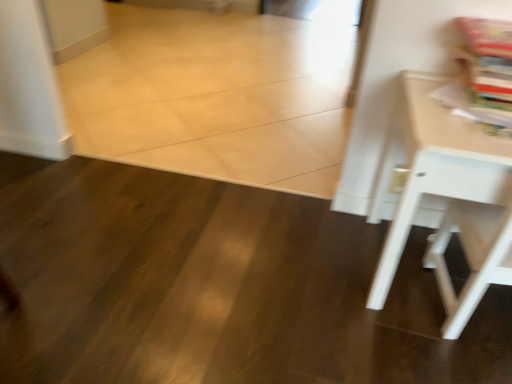
In order to face matte paper magazine at upper right, should I rotate leftwards or rightwards?

A 30.938 degree turn to the right will do.

The image size is (512, 384). Identify the location of matte paper magazine at upper right. (488, 70).

The image size is (512, 384). What do you see at coordinates (488, 70) in the screenshot?
I see `matte paper magazine at upper right` at bounding box center [488, 70].

Image resolution: width=512 pixels, height=384 pixels. What do you see at coordinates (448, 197) in the screenshot?
I see `white matte table at right` at bounding box center [448, 197].

Locate an element on the screen. The width and height of the screenshot is (512, 384). white matte table at right is located at coordinates (448, 197).

I want to click on matte paper magazine at upper right, so click(x=488, y=70).

Is matte paper magazine at upper right to the right of white matte table at right from the viewer's perspective?

Yes, matte paper magazine at upper right is to the right of white matte table at right.

Is matte paper magazine at upper right closer to camera compared to white matte table at right?

No, matte paper magazine at upper right is further to the viewer.

Is point (471, 63) positioned in front of point (464, 206)?

That is True.

From the image's perspective, who appears lower, matte paper magazine at upper right or white matte table at right?

white matte table at right.

From a real-world perspective, is matte paper magazine at upper right positioned over white matte table at right based on gravity?

Yes, from a real-world perspective, matte paper magazine at upper right is on top of white matte table at right.

Looking at this image, between matte paper magazine at upper right and white matte table at right, which one has larger width?

Wider between the two is white matte table at right.

Can you confirm if matte paper magazine at upper right is taller than white matte table at right?

In fact, matte paper magazine at upper right may be shorter than white matte table at right.

Which of these two, matte paper magazine at upper right or white matte table at right, is bigger?

white matte table at right is bigger.

Is matte paper magazine at upper right situated inside white matte table at right or outside?

matte paper magazine at upper right is inside white matte table at right.

Is matte paper magazine at upper right positioned far away from white matte table at right?

Actually, matte paper magazine at upper right and white matte table at right are a little close together.

Is matte paper magazine at upper right turned away from white matte table at right?

Yes, matte paper magazine at upper right is positioned with its back facing white matte table at right.

Find the location of a particular element. Image resolution: width=512 pixels, height=384 pixels. table below the matte paper magazine at upper right (from the image's perspective) is located at coordinates [448, 197].

Is white matte table at right to the left of matte paper magazine at upper right from the viewer's perspective?

Indeed, white matte table at right is positioned on the left side of matte paper magazine at upper right.

Considering the positions of objects white matte table at right and matte paper magazine at upper right in the image provided, who is in front, white matte table at right or matte paper magazine at upper right?

white matte table at right is more forward.

Is point (401, 208) closer to viewer compared to point (471, 113)?

Yes.

From the image's perspective, which one is positioned higher, white matte table at right or matte paper magazine at upper right?

matte paper magazine at upper right is shown above in the image.

From a real-world perspective, is white matte table at right on matte paper magazine at upper right?

Actually, white matte table at right is physically below matte paper magazine at upper right in the real world.

Can you confirm if white matte table at right is wider than matte paper magazine at upper right?

Yes.

Does white matte table at right have a lesser height compared to matte paper magazine at upper right?

No, white matte table at right is not shorter than matte paper magazine at upper right.

Considering the sizes of white matte table at right and matte paper magazine at upper right in the image, is white matte table at right bigger or smaller than matte paper magazine at upper right?

white matte table at right is bigger than matte paper magazine at upper right.

Is white matte table at right spatially inside matte paper magazine at upper right, or outside of it?

white matte table at right lies outside matte paper magazine at upper right.

Is white matte table at right not close to matte paper magazine at upper right?

No, white matte table at right is not far away from matte paper magazine at upper right.

Is white matte table at right aimed at matte paper magazine at upper right?

No, white matte table at right is not oriented towards matte paper magazine at upper right.

What's the angular difference between white matte table at right and matte paper magazine at upper right's facing directions?

The angular difference between white matte table at right and matte paper magazine at upper right is 30.3 degrees.

The height and width of the screenshot is (384, 512). In the image, there is a matte paper magazine at upper right. In order to click on table below it (from a real-world perspective) in this screenshot , I will do `click(448, 197)`.

Identify the location of magazine located behind the white matte table at right. The image size is (512, 384). (488, 70).

This screenshot has height=384, width=512. What are the coordinates of `magazine located above the white matte table at right (from the image's perspective)` in the screenshot? It's located at (488, 70).